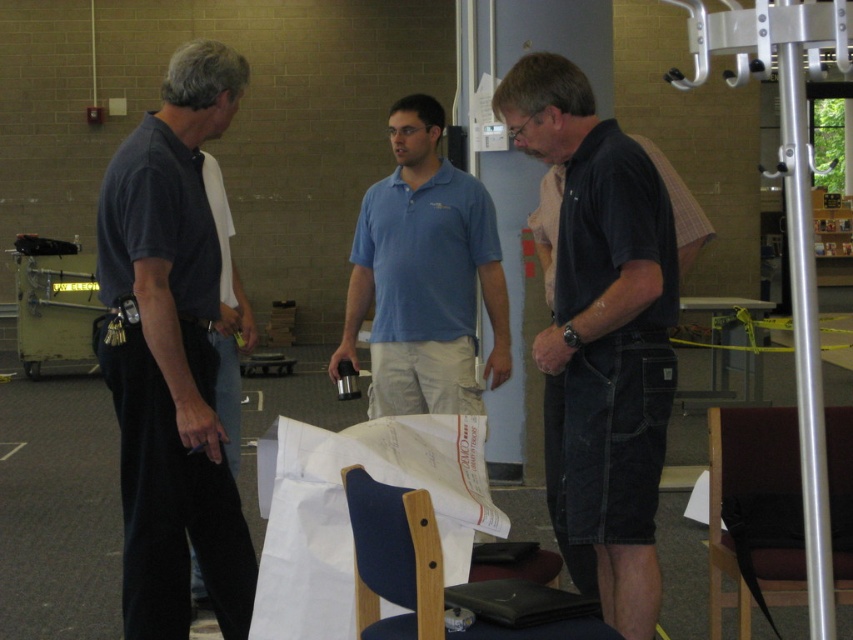
Where is `dark blue shirt at left`? dark blue shirt at left is located at coordinates (171, 356).

Is dark blue shirt at left to the right of dark blue jeans at left from the viewer's perspective?

In fact, dark blue shirt at left is to the left of dark blue jeans at left.

Is point (125, 397) positioned behind point (216, 182)?

That is False.

Where is `dark blue shirt at left`? The image size is (853, 640). dark blue shirt at left is located at coordinates [x=171, y=356].

Which is behind, point (177, 588) or point (363, 516)?

The point (177, 588) is more distant.

Describe the element at coordinates (171, 356) in the screenshot. I see `dark blue shirt at left` at that location.

The height and width of the screenshot is (640, 853). I want to click on dark blue shirt at left, so (171, 356).

Which of these two, blue cotton polo shirt at center or blue fabric chair at lower center, stands taller?

With more height is blue cotton polo shirt at center.

Measure the distance between blue cotton polo shirt at center and blue fabric chair at lower center.

The distance of blue cotton polo shirt at center from blue fabric chair at lower center is 1.94 meters.

At what (x,y) coordinates should I click in order to perform the action: click on blue cotton polo shirt at center. Please return your answer as a coordinate pair (x, y). The width and height of the screenshot is (853, 640). Looking at the image, I should click on (424, 276).

Where is `blue cotton polo shirt at center`? The image size is (853, 640). blue cotton polo shirt at center is located at coordinates (424, 276).